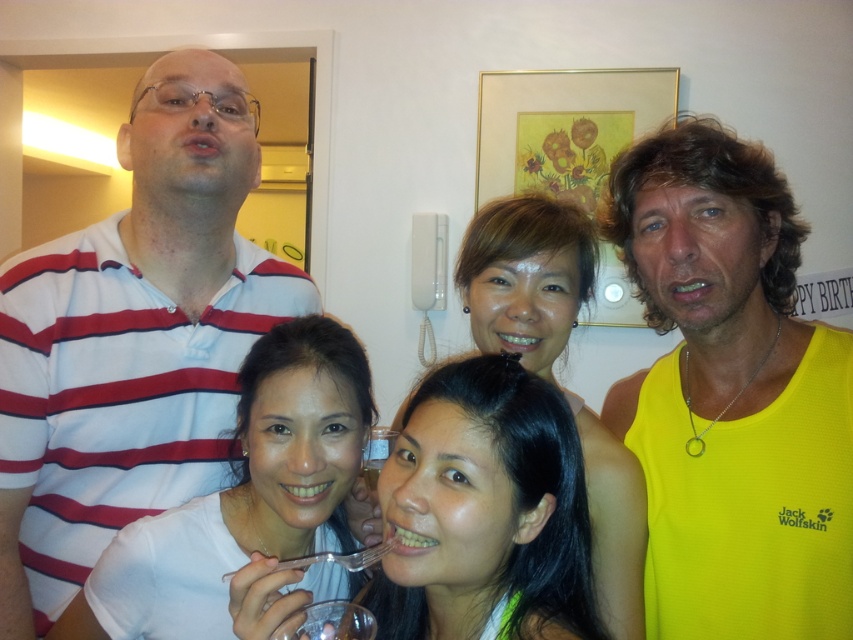
Question: Does white striped shirt at left have a lesser width compared to transparent plastic wine glass at lower center?

Choices:
 (A) yes
 (B) no

Answer: (B)

Question: Does white striped shirt at left come behind yellow fabric tank top at right?

Choices:
 (A) no
 (B) yes

Answer: (B)

Question: Is matte yellow shirt at center to the right of transparent plastic wine glass at lower center from the viewer's perspective?

Choices:
 (A) yes
 (B) no

Answer: (A)

Question: Which object is closer to the camera taking this photo?

Choices:
 (A) white matte shirt at center
 (B) yellow fabric tank top at right
 (C) white striped shirt at left

Answer: (A)

Question: Based on their relative distances, which object is farther from the yellow fabric tank top at right?

Choices:
 (A) white matte shirt at center
 (B) white striped shirt at left
 (C) matte yellow shirt at center

Answer: (B)

Question: Among these objects, which one is nearest to the camera?

Choices:
 (A) clear plastic cup at center
 (B) yellow fabric tank top at right
 (C) white matte shirt at center

Answer: (C)